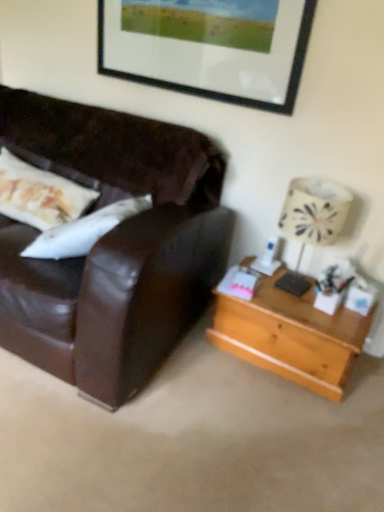
Locate an element on the screen. The width and height of the screenshot is (384, 512). vacant area situated below white fabric lampshade at right (from a real-world perspective) is located at coordinates (298, 284).